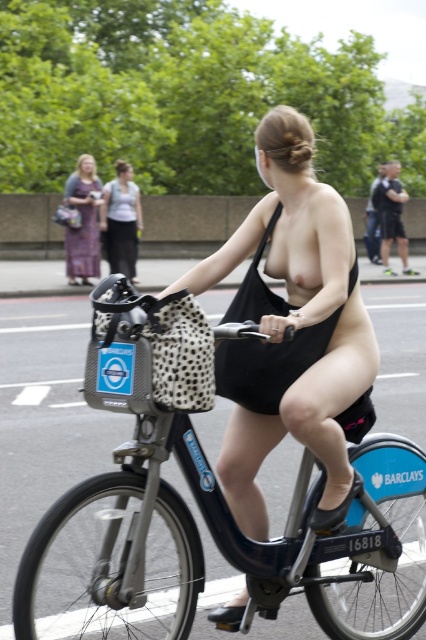
What do you see at coordinates (207, 528) in the screenshot? Image resolution: width=426 pixels, height=640 pixels. I see `metallic blue bicycle at center` at bounding box center [207, 528].

Is metallic blue bicycle at center shorter than black fabric bandeau at upper center?

Yes, metallic blue bicycle at center is shorter than black fabric bandeau at upper center.

Describe the element at coordinates (207, 528) in the screenshot. This screenshot has height=640, width=426. I see `metallic blue bicycle at center` at that location.

Image resolution: width=426 pixels, height=640 pixels. I want to click on metallic blue bicycle at center, so click(x=207, y=528).

Can you confirm if metallic blue bicycle at center is bigger than white shirt at upper center?

Correct, metallic blue bicycle at center is larger in size than white shirt at upper center.

Can you confirm if metallic blue bicycle at center is positioned below white shirt at upper center?

Indeed, metallic blue bicycle at center is positioned under white shirt at upper center.

Which is behind, point (189, 417) or point (131, 225)?

The point (131, 225) is behind.

Find the location of a particular element. The width and height of the screenshot is (426, 640). metallic blue bicycle at center is located at coordinates (207, 528).

Is white shirt at upper center shorter than printed fabric dress at left?

No.

Who is more distant from viewer, (111, 243) or (83, 250)?

The point (111, 243) is behind.

Identify the location of white shirt at upper center. (120, 220).